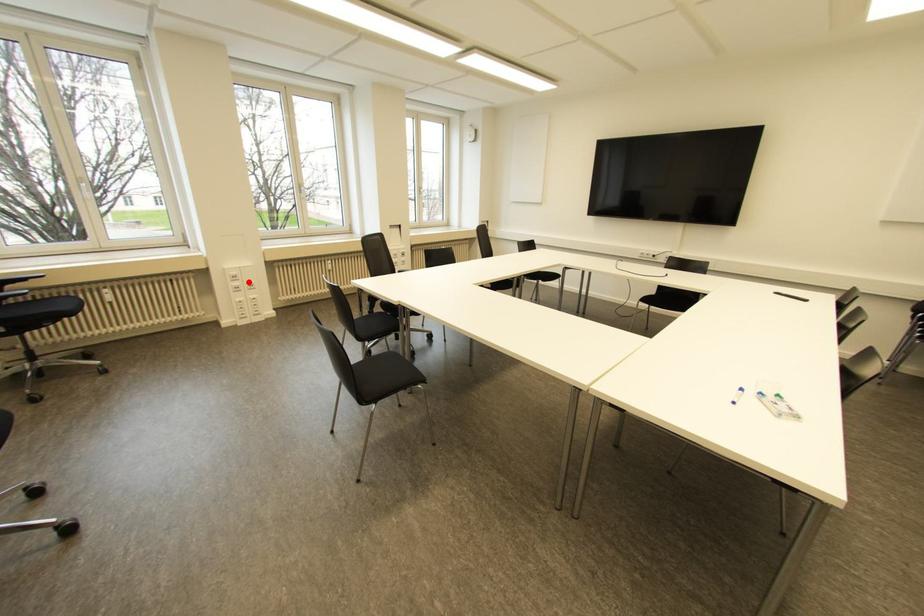
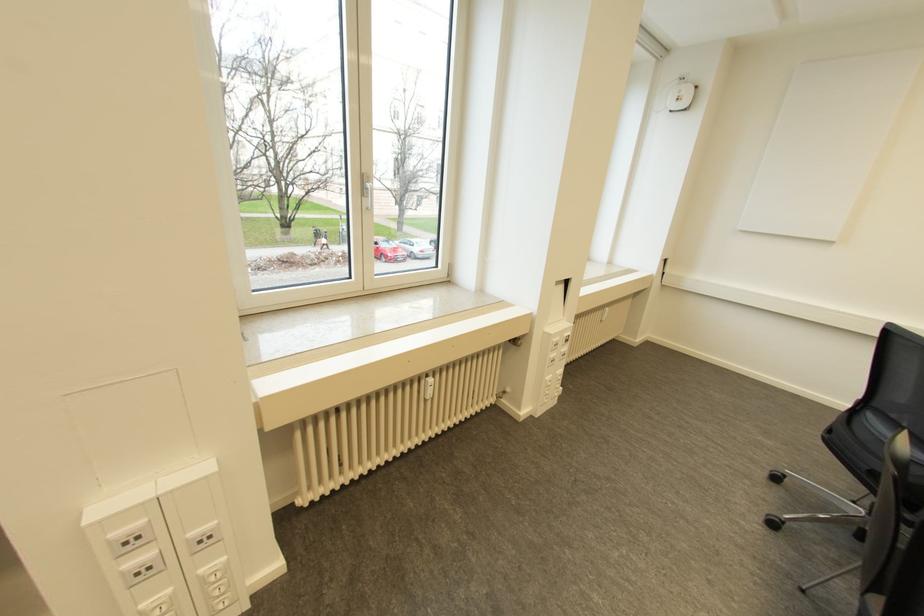
Find the pixel in the second image that matches the highlighted location in the first image.

(197, 531)